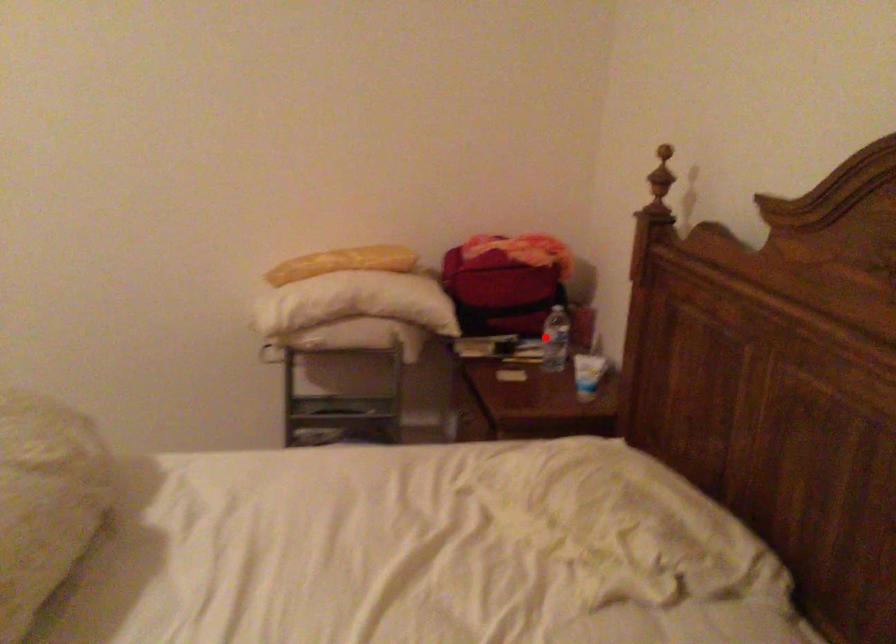
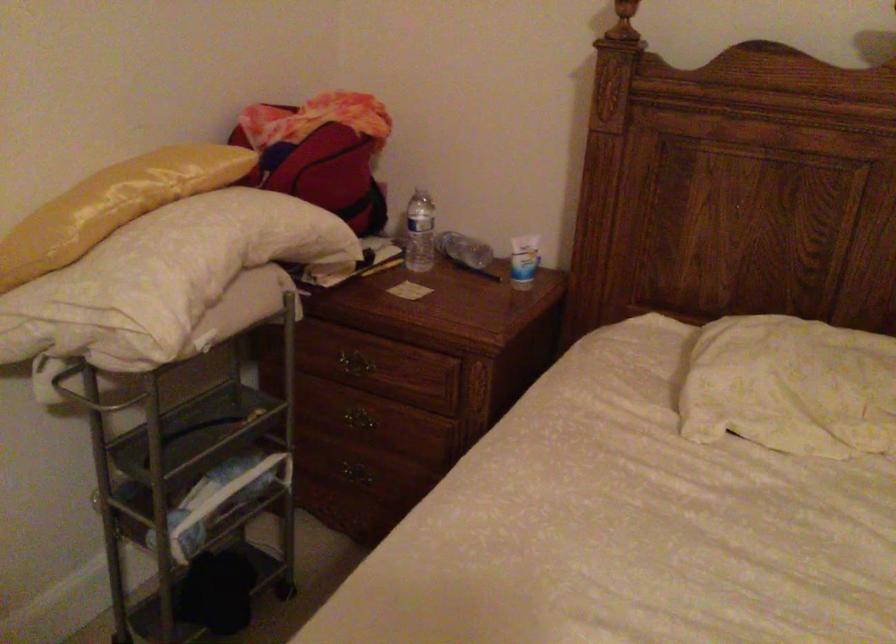
Question: I am providing you with two images of the same scene from different viewpoints. In image1, a red point is highlighted. Considering the same 3D point in image2, which of the following is correct?

Choices:
 (A) It is closer
 (B) It is farther

Answer: (A)